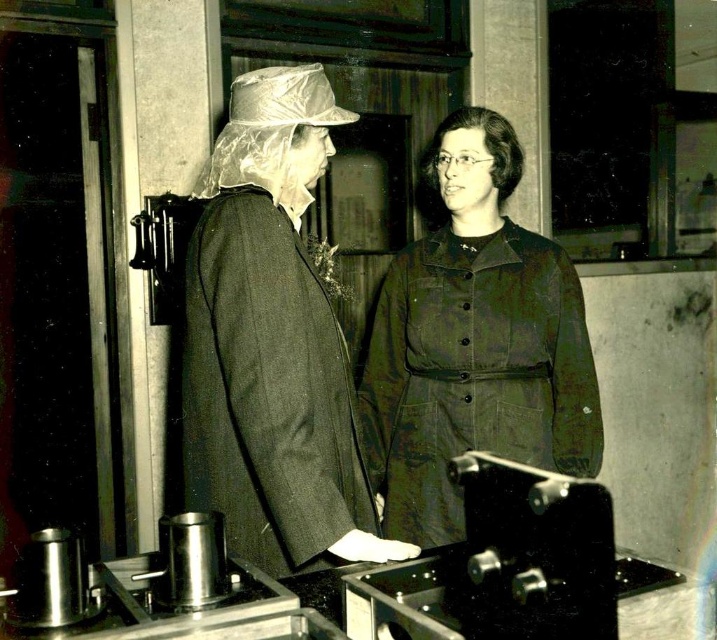
Question: Does matte black coat at center appear under olive green fabric coat at center?

Choices:
 (A) no
 (B) yes

Answer: (A)

Question: Can you confirm if matte black coat at center is thinner than olive green fabric coat at center?

Choices:
 (A) yes
 (B) no

Answer: (A)

Question: Which point appears farthest from the camera in this image?

Choices:
 (A) tap(315, 68)
 (B) tap(589, 454)

Answer: (B)

Question: Does matte black coat at center appear under olive green fabric coat at center?

Choices:
 (A) no
 (B) yes

Answer: (A)